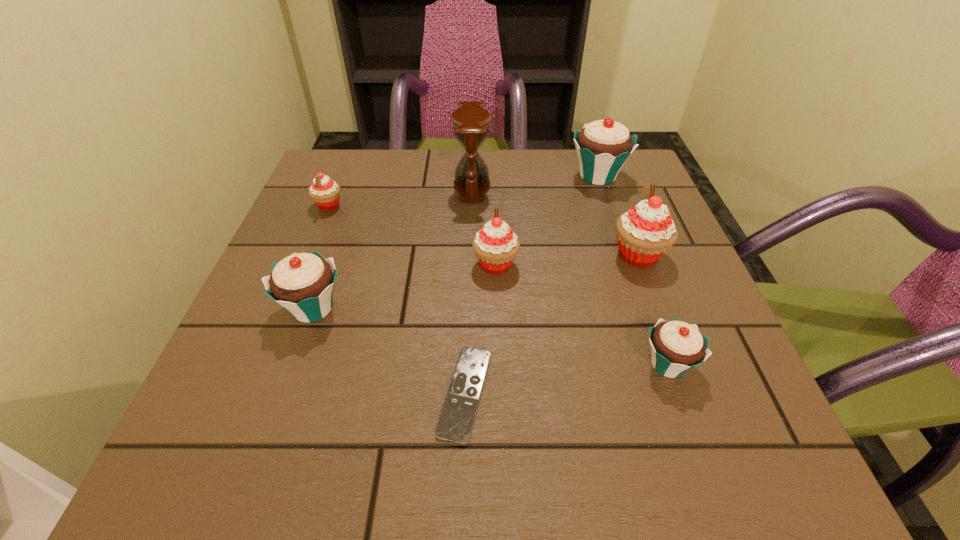
Locate an element on the screen. The height and width of the screenshot is (540, 960). vacant space at the near left corner is located at coordinates (295, 422).

Where is `vacant space at the far right corner of the desktop`? The height and width of the screenshot is (540, 960). vacant space at the far right corner of the desktop is located at coordinates (612, 200).

Find the location of `vacant area that lies between the farthest teal cupcake and the biggest pink cupcake`. vacant area that lies between the farthest teal cupcake and the biggest pink cupcake is located at coordinates (617, 215).

Where is `unoccupied position between the second farthest cupcake and the second pink cupcake from left to right`? This screenshot has width=960, height=540. unoccupied position between the second farthest cupcake and the second pink cupcake from left to right is located at coordinates (412, 234).

The height and width of the screenshot is (540, 960). In order to click on vacant space that is in between the nearest cupcake and the second biggest teal cupcake in this screenshot , I will do `click(491, 336)`.

Find the location of a particular element. This screenshot has width=960, height=540. vacant point located between the hourglass and the fifth nearest cupcake is located at coordinates (400, 195).

Where is `empty space that is in between the second biggest pink cupcake and the hourglass`? This screenshot has width=960, height=540. empty space that is in between the second biggest pink cupcake and the hourglass is located at coordinates [484, 225].

Image resolution: width=960 pixels, height=540 pixels. Find the location of `vacant space that's between the second farthest teal cupcake and the biggest pink cupcake`. vacant space that's between the second farthest teal cupcake and the biggest pink cupcake is located at coordinates (475, 281).

This screenshot has width=960, height=540. I want to click on unoccupied position between the remote control and the nearest cupcake, so click(566, 379).

Where is `vacant area between the nearest teal cupcake and the biggest pink cupcake`? vacant area between the nearest teal cupcake and the biggest pink cupcake is located at coordinates (653, 309).